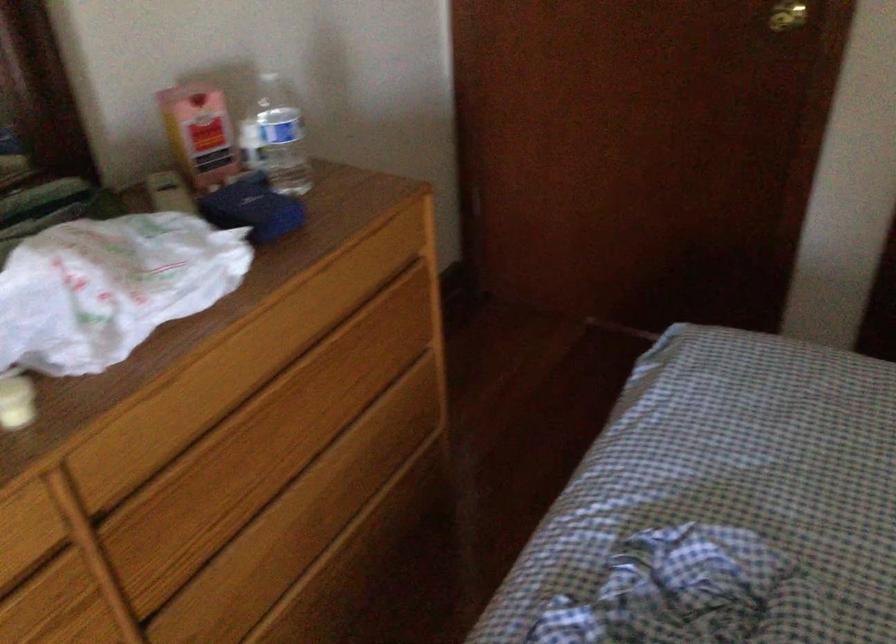
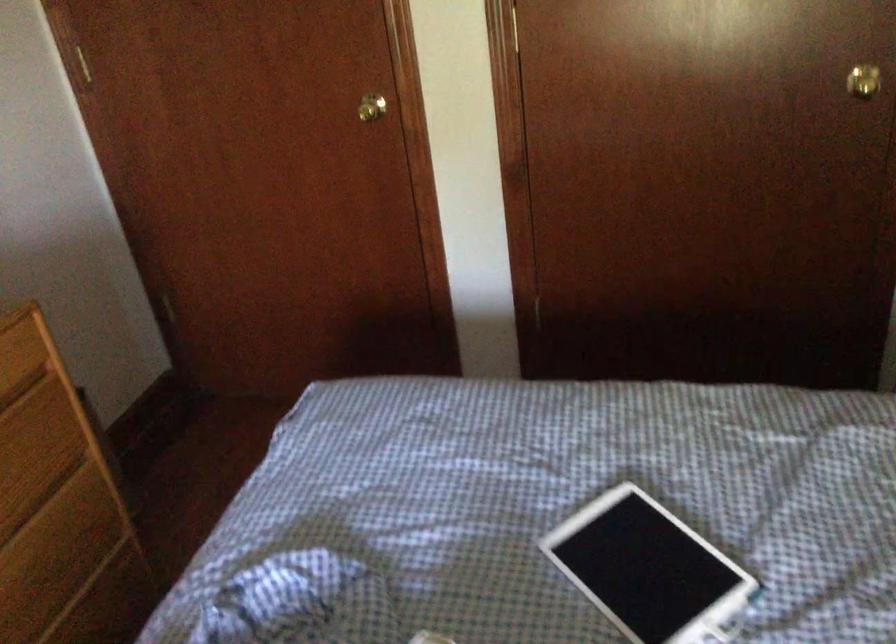
Based on the photo, the images are taken continuously from a first-person perspective. In which direction are you moving?

The cameraman walked toward right, backward.